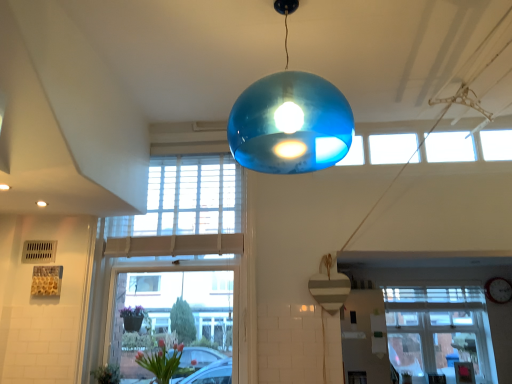
Question: Does wooden heart at center come in front of clear glass window at center, the 2th window when ordered from right to left?

Choices:
 (A) no
 (B) yes

Answer: (B)

Question: Is clear glass window at center, the 2th window when ordered from right to left, at the back of wooden heart at center?

Choices:
 (A) yes
 (B) no

Answer: (B)

Question: Does wooden heart at center have a smaller size compared to clear glass window at center, marked as the 2th window in a back-to-front arrangement?

Choices:
 (A) no
 (B) yes

Answer: (B)

Question: Does wooden heart at center have a lesser height compared to clear glass window at center, which is the first window in front-to-back order?

Choices:
 (A) yes
 (B) no

Answer: (A)

Question: Can you confirm if wooden heart at center is bigger than clear glass window at center, the first window when ordered from top to bottom?

Choices:
 (A) yes
 (B) no

Answer: (B)

Question: From a real-world perspective, is wooden heart at center physically below clear glass window at center, the 2th window when ordered from right to left?

Choices:
 (A) yes
 (B) no

Answer: (A)

Question: From a real-world perspective, is matte white clock at center located higher than wooden heart at center?

Choices:
 (A) yes
 (B) no

Answer: (A)

Question: Would you say matte white clock at center contains wooden heart at center?

Choices:
 (A) no
 (B) yes

Answer: (A)

Question: Is the position of matte white clock at center less distant than that of wooden heart at center?

Choices:
 (A) no
 (B) yes

Answer: (A)

Question: Is matte white clock at center bigger than wooden heart at center?

Choices:
 (A) yes
 (B) no

Answer: (B)

Question: Is matte white clock at center oriented away from wooden heart at center?

Choices:
 (A) yes
 (B) no

Answer: (B)

Question: Are matte white clock at center and wooden heart at center far apart?

Choices:
 (A) no
 (B) yes

Answer: (B)

Question: From the image's perspective, is white matte exhaust hood at upper left located beneath pink glass vase at lower left?

Choices:
 (A) no
 (B) yes

Answer: (A)